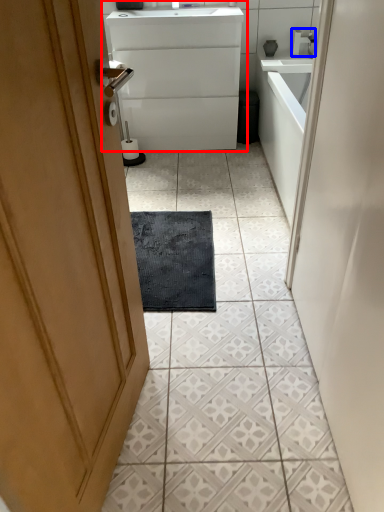
Question: Which object appears closest to the camera in this image, bathroom cabinet (highlighted by a red box) or tap (highlighted by a blue box)?

Choices:
 (A) bathroom cabinet
 (B) tap

Answer: (A)